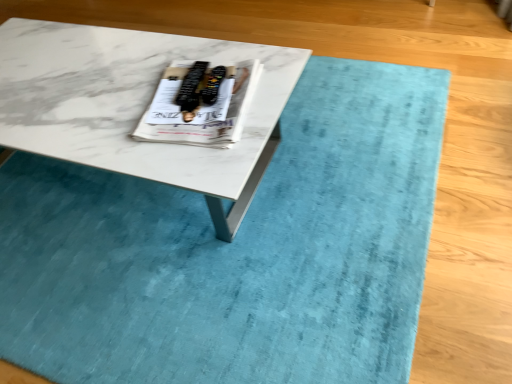
Identify the location of free location to the right of white glossy magazine at center. This screenshot has width=512, height=384. (270, 81).